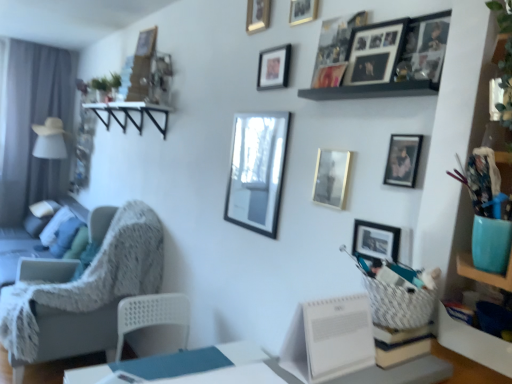
At what (x,y) coordinates should I click in order to perform the action: click on metallic silver picture frame at lower right, marked as the ninth picture frame in a top-to-bottom arrangement. Please return your answer as a coordinate pair (x, y). Looking at the image, I should click on (376, 241).

Locate an element on the screen. The image size is (512, 384). metallic gold picture frame at upper center, which is the seventh picture frame from bottom to top is located at coordinates (273, 67).

Locate an element on the screen. This screenshot has width=512, height=384. matte black picture frame at center, arranged as the fourth picture frame when ordered from the bottom is located at coordinates [x=257, y=171].

Describe the element at coordinates (87, 293) in the screenshot. The image size is (512, 384). I see `textured gray chair at left` at that location.

Identify the location of metallic silver picture frame at lower right, the 1th picture frame in the bottom-to-top sequence. (376, 241).

Looking at this image, can you confirm if gold metallic picture frame at upper center, the eighth picture frame ordered from the bottom, is positioned to the right of gold metallic picture frame at upper center, positioned as the 9th picture frame in bottom-to-top order?

Correct, you'll find gold metallic picture frame at upper center, the eighth picture frame ordered from the bottom, to the right of gold metallic picture frame at upper center, positioned as the 9th picture frame in bottom-to-top order.

Looking at this image, between gold metallic picture frame at upper center, the eighth picture frame ordered from the bottom, and gold metallic picture frame at upper center, the 1th picture frame from the top, which one has smaller width?

gold metallic picture frame at upper center, the eighth picture frame ordered from the bottom.

Measure the distance between gold metallic picture frame at upper center, the eighth picture frame ordered from the bottom, and gold metallic picture frame at upper center, positioned as the 9th picture frame in bottom-to-top order.

A distance of 9.51 inches exists between gold metallic picture frame at upper center, the eighth picture frame ordered from the bottom, and gold metallic picture frame at upper center, positioned as the 9th picture frame in bottom-to-top order.

Is gold metallic picture frame at upper center, the eighth picture frame ordered from the bottom, bigger or smaller than gold metallic picture frame at upper center, the 1th picture frame from the top?

gold metallic picture frame at upper center, the eighth picture frame ordered from the bottom, is smaller than gold metallic picture frame at upper center, the 1th picture frame from the top.

From the image's perspective, who appears lower, white plastic table at lower center or metallic gold picture frame at upper center, which is the seventh picture frame from bottom to top?

white plastic table at lower center.

Considering their positions, is white plastic table at lower center located in front of or behind metallic gold picture frame at upper center, which is the seventh picture frame from bottom to top?

Clearly, white plastic table at lower center is in front of metallic gold picture frame at upper center, which is the seventh picture frame from bottom to top.

Considering the sizes of objects white plastic table at lower center and metallic gold picture frame at upper center, which is the seventh picture frame from bottom to top, in the image provided, who is bigger, white plastic table at lower center or metallic gold picture frame at upper center, which is the seventh picture frame from bottom to top,?

white plastic table at lower center is bigger.

Between white plastic table at lower center and metallic gold picture frame at upper center, acting as the third picture frame starting from the top, which one has more height?

Standing taller between the two is metallic gold picture frame at upper center, acting as the third picture frame starting from the top.

From the picture: Considering the sizes of objects metallic gold picture frame at upper center, which is the 6th picture frame in bottom-to-top order, and metallic gold picture frame at upper center, which is the 5th picture frame in top-to-bottom order, in the image provided, who is thinner, metallic gold picture frame at upper center, which is the 6th picture frame in bottom-to-top order, or metallic gold picture frame at upper center, which is the 5th picture frame in top-to-bottom order,?

Thinner between the two is metallic gold picture frame at upper center, which is the 6th picture frame in bottom-to-top order.

Which point is more distant from viewer, [345,52] or [323,87]?

The point [323,87] is more distant.

From the image's perspective, between metallic gold picture frame at upper center, the fourth picture frame in the top-to-bottom sequence, and metallic gold picture frame at upper center, the fifth picture frame when ordered from bottom to top, who is located below?

From the image's view, metallic gold picture frame at upper center, the fifth picture frame when ordered from bottom to top, is below.

Is textured gray couch at left taller or shorter than white plastic table at lower center?

In the image, textured gray couch at left appears to be taller than white plastic table at lower center.

Find the location of `studio couch behind the white plastic table at lower center`. studio couch behind the white plastic table at lower center is located at coordinates (16, 252).

From the picture: Is textured gray couch at left positioned far away from white plastic table at lower center?

Yes, textured gray couch at left and white plastic table at lower center are located far from each other.

Considering the points (15, 254) and (241, 375), which point is behind, point (15, 254) or point (241, 375)?

The point (15, 254) is more distant.

From the image's perspective, is textured gray chair at left located above or below gold metallic picture frame at upper center, the eighth picture frame ordered from the bottom?

Based on their image positions, textured gray chair at left is located beneath gold metallic picture frame at upper center, the eighth picture frame ordered from the bottom.

Is textured gray chair at left facing away from gold metallic picture frame at upper center, marked as the 2th picture frame in a top-to-bottom arrangement?

That's not correct — textured gray chair at left is not looking away from gold metallic picture frame at upper center, marked as the 2th picture frame in a top-to-bottom arrangement.

Do you think textured gray chair at left is within gold metallic picture frame at upper center, marked as the 2th picture frame in a top-to-bottom arrangement, or outside of it?

textured gray chair at left cannot be found inside gold metallic picture frame at upper center, marked as the 2th picture frame in a top-to-bottom arrangement.

Considering the relative positions of textured gray chair at left and gold metallic picture frame at upper center, marked as the 2th picture frame in a top-to-bottom arrangement, in the image provided, is textured gray chair at left in front of gold metallic picture frame at upper center, marked as the 2th picture frame in a top-to-bottom arrangement,?

No, it is not.

Looking at this image, is gold metallic picture frame at upper right, marked as the 7th picture frame in a top-to-bottom arrangement, not within matte black picture frame at center, arranged as the fourth picture frame when ordered from the bottom?

Absolutely, gold metallic picture frame at upper right, marked as the 7th picture frame in a top-to-bottom arrangement, is external to matte black picture frame at center, arranged as the fourth picture frame when ordered from the bottom.

Is gold metallic picture frame at upper right, the 3th picture frame positioned from the bottom, facing away from matte black picture frame at center, placed as the 6th picture frame when sorted from top to bottom?

gold metallic picture frame at upper right, the 3th picture frame positioned from the bottom, is not turned away from matte black picture frame at center, placed as the 6th picture frame when sorted from top to bottom.

Which picture frame is the 8th one when counting from the right side of the matte black picture frame at center, placed as the 6th picture frame when sorted from top to bottom? Please provide its 2D coordinates.

[(403, 160)]

Between gold metallic picture frame at upper right, marked as the 7th picture frame in a top-to-bottom arrangement, and matte black picture frame at center, arranged as the fourth picture frame when ordered from the bottom, which one has larger size?

matte black picture frame at center, arranged as the fourth picture frame when ordered from the bottom, is bigger.

Where is `table that appears below the black wooden shelf at upper center (from a real-world perspective)`? This screenshot has height=384, width=512. table that appears below the black wooden shelf at upper center (from a real-world perspective) is located at coordinates (400, 373).

Does point (426, 361) come in front of point (417, 87)?

Yes, it is.

Between white plastic table at lower center and black wooden shelf at upper center, which one has smaller width?

black wooden shelf at upper center.

Between white plastic table at lower center and black wooden shelf at upper center, which one appears on the right side from the viewer's perspective?

black wooden shelf at upper center is more to the right.

Locate an element on the screen. The height and width of the screenshot is (384, 512). the 3rd picture frame behind the gold metallic picture frame at upper center, the eighth picture frame ordered from the bottom is located at coordinates coord(257,15).

This screenshot has width=512, height=384. What are the coordinates of `the 6th picture frame positioned above the white plastic table at lower center (from a real-world perspective)` in the screenshot? It's located at (273, 67).

Estimate the real-world distances between objects in this image. Which object is further from matte black picture frame at center, arranged as the fourth picture frame when ordered from the bottom, gold metallic picture frame at upper center, which is counted as the 8th picture frame, starting from the top, or gold metallic picture frame at upper right, marked as the 7th picture frame in a top-to-bottom arrangement?

Based on the image, gold metallic picture frame at upper right, marked as the 7th picture frame in a top-to-bottom arrangement, appears to be further to matte black picture frame at center, arranged as the fourth picture frame when ordered from the bottom.

Based on their spatial positions, is metallic silver picture frame at lower right, marked as the ninth picture frame in a top-to-bottom arrangement, or metallic gold picture frame at upper center, which is the 6th picture frame in bottom-to-top order, closer to gold metallic picture frame at upper center, which is counted as the 8th picture frame, starting from the top?

metallic silver picture frame at lower right, marked as the ninth picture frame in a top-to-bottom arrangement, is positioned closer to the anchor gold metallic picture frame at upper center, which is counted as the 8th picture frame, starting from the top.

From the image, which object appears to be farther from textured gray chair at left, textured gray couch at left or metallic gold picture frame at upper center, the fifth picture frame when ordered from bottom to top?

metallic gold picture frame at upper center, the fifth picture frame when ordered from bottom to top, is positioned further to the anchor textured gray chair at left.

When comparing their distances from gold metallic picture frame at upper center, which is counted as the 8th picture frame, starting from the top, does gold metallic picture frame at upper center, marked as the 2th picture frame in a top-to-bottom arrangement, or white plastic table at lower center seem further?

white plastic table at lower center.

Which object lies further to the anchor point gold metallic picture frame at upper right, the 3th picture frame positioned from the bottom, metallic gold picture frame at upper center, acting as the third picture frame starting from the top, or black wooden shelf at upper center?

metallic gold picture frame at upper center, acting as the third picture frame starting from the top, is further to gold metallic picture frame at upper right, the 3th picture frame positioned from the bottom.

From the image, which object appears to be farther from metallic gold picture frame at upper center, the fifth picture frame when ordered from bottom to top, metallic silver picture frame at lower right, marked as the ninth picture frame in a top-to-bottom arrangement, or gold metallic picture frame at upper right, the 3th picture frame positioned from the bottom?

metallic silver picture frame at lower right, marked as the ninth picture frame in a top-to-bottom arrangement, is positioned further to the anchor metallic gold picture frame at upper center, the fifth picture frame when ordered from bottom to top.

Which object lies further to the anchor point gold metallic picture frame at upper center, marked as the 2th picture frame in a bottom-to-top arrangement, textured gray chair at left or white plastic table at lower center?

textured gray chair at left is positioned further to the anchor gold metallic picture frame at upper center, marked as the 2th picture frame in a bottom-to-top arrangement.

Looking at this image, based on their spatial positions, is textured gray chair at left or black wooden shelf at upper center further from gold metallic picture frame at upper center, the 1th picture frame from the top?

textured gray chair at left is further to gold metallic picture frame at upper center, the 1th picture frame from the top.

Where is `picture frame between white plastic table at lower center and metallic silver picture frame at lower right, marked as the ninth picture frame in a top-to-bottom arrangement, along the z-axis`? picture frame between white plastic table at lower center and metallic silver picture frame at lower right, marked as the ninth picture frame in a top-to-bottom arrangement, along the z-axis is located at coordinates coord(403,160).

Image resolution: width=512 pixels, height=384 pixels. What are the coordinates of `shelf that lies between metallic gold picture frame at upper center, acting as the third picture frame starting from the top, and metallic silver picture frame at lower right, the 1th picture frame in the bottom-to-top sequence, from top to bottom` in the screenshot? It's located at (372, 90).

Locate an element on the screen. This screenshot has width=512, height=384. shelf that lies between metallic gold picture frame at upper center, the fifth picture frame when ordered from bottom to top, and gold metallic picture frame at upper right, marked as the 7th picture frame in a top-to-bottom arrangement, from top to bottom is located at coordinates (372, 90).

You are a GUI agent. You are given a task and a screenshot of the screen. Output one action in this format:
    pyautogui.click(x=<x>, y=<y>)
    Task: Click on the shelf between gold metallic picture frame at upper center, marked as the 2th picture frame in a top-to-bottom arrangement, and white plastic table at lower center, in the vertical direction
    Image resolution: width=512 pixels, height=384 pixels.
    Given the screenshot: What is the action you would take?
    pyautogui.click(x=372, y=90)